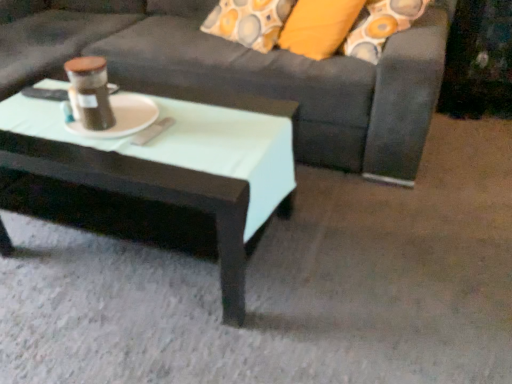
In order to click on vacant point above matte black coffee table at center (from a real-world perspective) in this screenshot , I will do `click(120, 128)`.